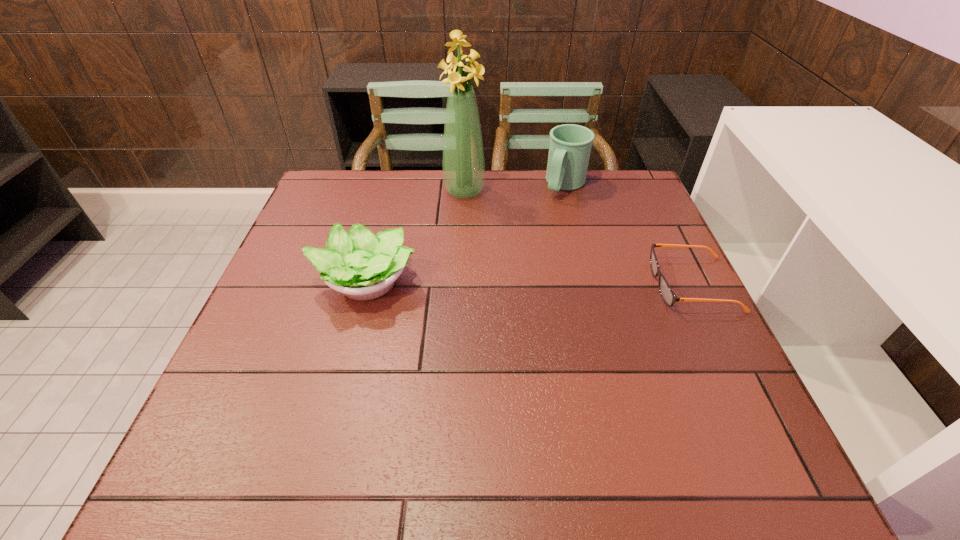
I want to click on lettuce, so click(x=362, y=266).

Image resolution: width=960 pixels, height=540 pixels. What are the coordinates of `the third tallest object` in the screenshot? It's located at (362, 266).

Image resolution: width=960 pixels, height=540 pixels. In order to click on the rightmost object in this screenshot , I will do `click(669, 297)`.

Identify the location of spectacles. The height and width of the screenshot is (540, 960). (669, 297).

You are a GUI agent. You are given a task and a screenshot of the screen. Output one action in this format:
    pyautogui.click(x=<x>, y=<y>)
    Task: Click on the third object from left to right
    
    Given the screenshot: What is the action you would take?
    pyautogui.click(x=570, y=146)

Where is `mug`? mug is located at coordinates (570, 146).

Identify the location of bouquet. (463, 163).

Where is `the third object from right to left`? This screenshot has height=540, width=960. the third object from right to left is located at coordinates (463, 163).

Where is `vacant region located 0.050m on the back of the leftmost object`? Image resolution: width=960 pixels, height=540 pixels. vacant region located 0.050m on the back of the leftmost object is located at coordinates (376, 242).

You are a GUI agent. You are given a task and a screenshot of the screen. Output one action in this format:
    pyautogui.click(x=<x>, y=<y>)
    Task: Click on the vacant space situated 0.100m on the front-facing side of the spectacles
    
    Given the screenshot: What is the action you would take?
    pyautogui.click(x=611, y=285)